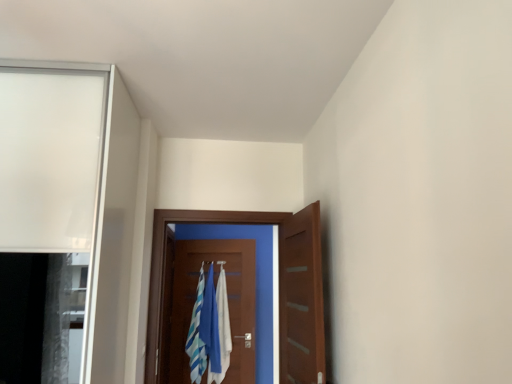
Question: Is blue fabric laundry at center taller than wooden door at center, which is counted as the 1th door, starting from the back?

Choices:
 (A) no
 (B) yes

Answer: (A)

Question: Can wooden door at center, which is counted as the 1th door, starting from the back, be found inside blue fabric laundry at center?

Choices:
 (A) no
 (B) yes

Answer: (A)

Question: From a real-world perspective, is blue fabric laundry at center physically above wooden door at center, which is counted as the 1th door, starting from the back?

Choices:
 (A) yes
 (B) no

Answer: (B)

Question: Is blue fabric laundry at center oriented towards wooden door at center, which is counted as the 3th door, starting from the front?

Choices:
 (A) yes
 (B) no

Answer: (A)

Question: Can you confirm if blue fabric laundry at center is positioned to the left of wooden door at center, which is counted as the 3th door, starting from the front?

Choices:
 (A) yes
 (B) no

Answer: (B)

Question: From the image's perspective, is wooden door at center, which ranks as the 2th door in front-to-back order, above or below white cotton bath towel at center?

Choices:
 (A) below
 (B) above

Answer: (B)

Question: Considering the positions of wooden door at center, positioned as the 2th door in back-to-front order, and white cotton bath towel at center in the image, is wooden door at center, positioned as the 2th door in back-to-front order, taller or shorter than white cotton bath towel at center?

Choices:
 (A) short
 (B) tall

Answer: (B)

Question: From a real-world perspective, is wooden door at center, positioned as the 2th door in back-to-front order, physically located above or below white cotton bath towel at center?

Choices:
 (A) above
 (B) below

Answer: (A)

Question: Looking at the image, does wooden door at center, which ranks as the 2th door in front-to-back order, seem bigger or smaller compared to white cotton bath towel at center?

Choices:
 (A) small
 (B) big

Answer: (B)

Question: Considering the positions of point (208, 337) and point (302, 289), is point (208, 337) closer or farther from the camera than point (302, 289)?

Choices:
 (A) farther
 (B) closer

Answer: (A)

Question: Is blue fabric laundry at center inside or outside of wooden door at center, the 3th door when ordered from back to front?

Choices:
 (A) inside
 (B) outside

Answer: (B)

Question: Considering the positions of blue fabric laundry at center and wooden door at center, the first door from the front, in the image, is blue fabric laundry at center taller or shorter than wooden door at center, the first door from the front,?

Choices:
 (A) short
 (B) tall

Answer: (B)

Question: From a real-world perspective, is blue fabric laundry at center above or below wooden door at center, the first door from the front?

Choices:
 (A) above
 (B) below

Answer: (B)

Question: From the image's perspective, relative to wooden door at center, positioned as the 2th door in back-to-front order, is blue fabric laundry at center above or below?

Choices:
 (A) below
 (B) above

Answer: (A)

Question: Do you think blue fabric laundry at center is within wooden door at center, positioned as the 2th door in back-to-front order, or outside of it?

Choices:
 (A) inside
 (B) outside

Answer: (B)